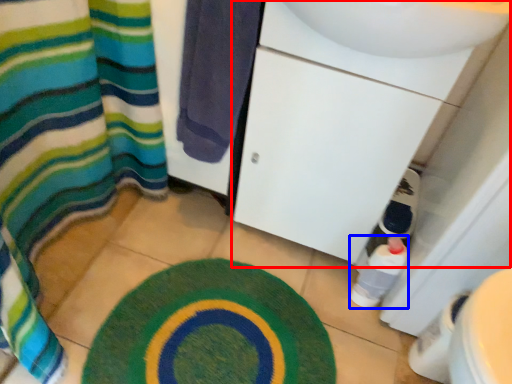
Question: Which of the following is the farthest to the observer, sink (highlighted by a red box) or bottle (highlighted by a blue box)?

Choices:
 (A) sink
 (B) bottle

Answer: (B)